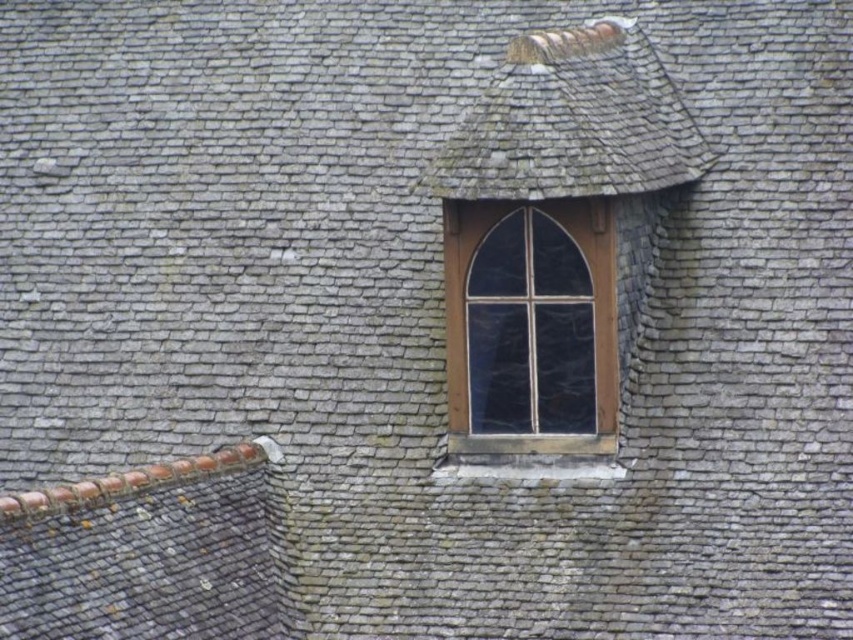
You are a window installer assessing a roof with a clear glass window at center and gray shingles at upper center. Which object is taller when viewed from below?

The clear glass window at center is taller than the gray shingles at upper center.

You are a window installer assessing a roof. You need to replace the clear glass window at center. Where should you place the new window relative to the gray shingles at upper center?

The clear glass window at center should be placed below the gray shingles at upper center as it is currently positioned there.